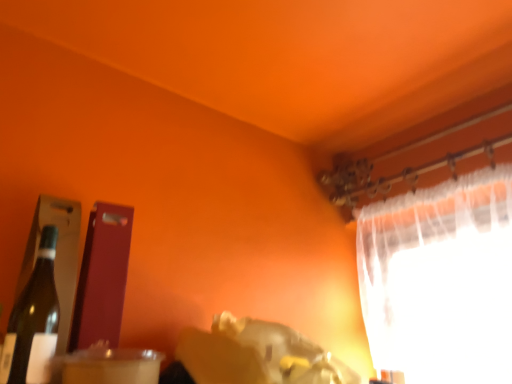
Question: From a real-world perspective, relative to white sheer curtain at upper right, is clear plastic straw at lower left vertically above or below?

Choices:
 (A) below
 (B) above

Answer: (A)

Question: Considering their positions, is clear plastic straw at lower left located in front of or behind white sheer curtain at upper right?

Choices:
 (A) behind
 (B) front

Answer: (B)

Question: Which of these objects is positioned closest to the white sheer curtain at upper right?

Choices:
 (A) clear plastic straw at lower left
 (B) matte glass bottle at left

Answer: (A)

Question: Considering the real-world distances, which object is closest to the matte glass bottle at left?

Choices:
 (A) clear plastic straw at lower left
 (B) white sheer curtain at upper right

Answer: (A)